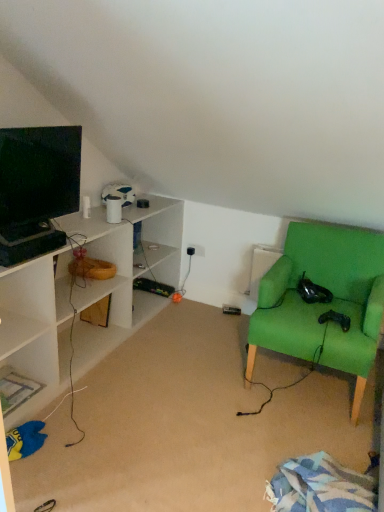
You are a GUI agent. You are given a task and a screenshot of the screen. Output one action in this format:
    pyautogui.click(x=<x>, y=<y>)
    Task: Click on the green fabric chair at right
    
    Given the screenshot: What is the action you would take?
    [x=323, y=304]

In order to click on matte black monitor at left in this screenshot , I will do `click(37, 180)`.

Describe the element at coordinates (196, 250) in the screenshot. I see `black plastic electric outlet at center` at that location.

Where is `green fabric chair at right`? This screenshot has width=384, height=512. green fabric chair at right is located at coordinates (323, 304).

Is green fabric chair at right next to black plastic electric outlet at center?

No, green fabric chair at right is not in contact with black plastic electric outlet at center.

Based on their positions, is green fabric chair at right located to the left or right of black plastic electric outlet at center?

From the image, it's evident that green fabric chair at right is to the left of black plastic electric outlet at center.

I want to click on plain on the left side of black plastic electric outlet at center, so click(188, 424).

Is black plastic electric outlet at center located within green fabric chair at right?

No, black plastic electric outlet at center is not inside green fabric chair at right.

Find the location of a particular element. The height and width of the screenshot is (512, 384). television that appears above the green fabric chair at right (from the image's perspective) is located at coordinates [x=37, y=180].

Which is in front, matte black monitor at left or green fabric chair at right?

green fabric chair at right is in front.

From the image's perspective, would you say matte black monitor at left is shown under green fabric chair at right?

No.

Does matte black monitor at left have a greater width compared to green fabric chair at right?

In fact, matte black monitor at left might be narrower than green fabric chair at right.

How distant is green fabric chair at right from green fabric chair at right?

green fabric chair at right and green fabric chair at right are 47.95 centimeters apart from each other.

Considering the positions of objects green fabric chair at right and green fabric chair at right in the image provided, who is more to the left, green fabric chair at right or green fabric chair at right?

green fabric chair at right.

Is green fabric chair at right completely or partially inside green fabric chair at right?

Actually, green fabric chair at right is outside green fabric chair at right.

Consider the image. Can you tell me how much black plastic electric outlet at center and green fabric chair at right differ in facing direction?

1.37 degrees separate the facing orientations of black plastic electric outlet at center and green fabric chair at right.

From the image's perspective, does black plastic electric outlet at center appear lower than green fabric chair at right?

Actually, black plastic electric outlet at center appears above green fabric chair at right in the image.

The width and height of the screenshot is (384, 512). In order to click on electric outlet that appears below the green fabric chair at right (from a real-world perspective) in this screenshot , I will do `click(196, 250)`.

In terms of width, does green fabric chair at right look wider or thinner when compared to black plastic electric outlet at center?

green fabric chair at right is wider than black plastic electric outlet at center.

How many degrees apart are the facing directions of green fabric chair at right and black plastic electric outlet at center?

green fabric chair at right and black plastic electric outlet at center are facing 1.37 degrees away from each other.

In the image, is green fabric chair at right positioned in front of or behind black plastic electric outlet at center?

Answer: In the image, green fabric chair at right appears in front of black plastic electric outlet at center.

From the image's perspective, is green fabric chair at right above or below black plastic electric outlet at center?

From the image's perspective, green fabric chair at right appears below black plastic electric outlet at center.

Is matte black monitor at left closer to camera compared to green fabric chair at right?

Yes, matte black monitor at left is closer to the camera.

Considering the relative sizes of matte black monitor at left and green fabric chair at right in the image provided, is matte black monitor at left wider than green fabric chair at right?

No.

Based on the photo, is matte black monitor at left shorter than green fabric chair at right?

Yes.

Between point (191, 254) and point (48, 172), which one is positioned in front?

Positioned in front is point (48, 172).

Between black plastic electric outlet at center and matte black monitor at left, which one has larger size?

With larger size is matte black monitor at left.

Is black plastic electric outlet at center looking in the opposite direction of matte black monitor at left?

black plastic electric outlet at center does not have its back to matte black monitor at left.

The image size is (384, 512). Identify the location of electric outlet lying above the green fabric chair at right (from the image's perspective). (196, 250).

Locate an element on the screen. This screenshot has width=384, height=512. plain below the matte black monitor at left (from the image's perspective) is located at coordinates (188, 424).

From the picture: When comparing their distances from green fabric chair at right, does black plastic electric outlet at center or matte black monitor at left seem closer?

matte black monitor at left lies closer to green fabric chair at right than the other object.

Based on their spatial positions, is black plastic electric outlet at center or green fabric chair at right closer to green fabric chair at right?

The object closer to green fabric chair at right is green fabric chair at right.

Considering their positions, is green fabric chair at right positioned further to matte black monitor at left than green fabric chair at right?

Based on the image, green fabric chair at right appears to be further to matte black monitor at left.

Based on their spatial positions, is green fabric chair at right or matte black monitor at left further from green fabric chair at right?

The object further to green fabric chair at right is matte black monitor at left.

From the image, which object appears to be nearer to green fabric chair at right, black plastic electric outlet at center or matte black monitor at left?

The object closer to green fabric chair at right is black plastic electric outlet at center.

Based on their spatial positions, is green fabric chair at right or black plastic electric outlet at center closer to matte black monitor at left?

The object closer to matte black monitor at left is green fabric chair at right.

Based on their spatial positions, is matte black monitor at left or green fabric chair at right further from black plastic electric outlet at center?

matte black monitor at left.

Looking at the image, which one is located further to green fabric chair at right, matte black monitor at left or black plastic electric outlet at center?

Based on the image, black plastic electric outlet at center appears to be further to green fabric chair at right.

Where is `chair located between matte black monitor at left and black plastic electric outlet at center in the depth direction`? The width and height of the screenshot is (384, 512). chair located between matte black monitor at left and black plastic electric outlet at center in the depth direction is located at coordinates (323, 304).

Identify the location of chair positioned between green fabric chair at right and black plastic electric outlet at center from near to far. (323, 304).

Where is `plain between matte black monitor at left and green fabric chair at right`? plain between matte black monitor at left and green fabric chair at right is located at coordinates coord(188,424).

Where is `television located between green fabric chair at right and black plastic electric outlet at center in the depth direction`? television located between green fabric chair at right and black plastic electric outlet at center in the depth direction is located at coordinates (37, 180).